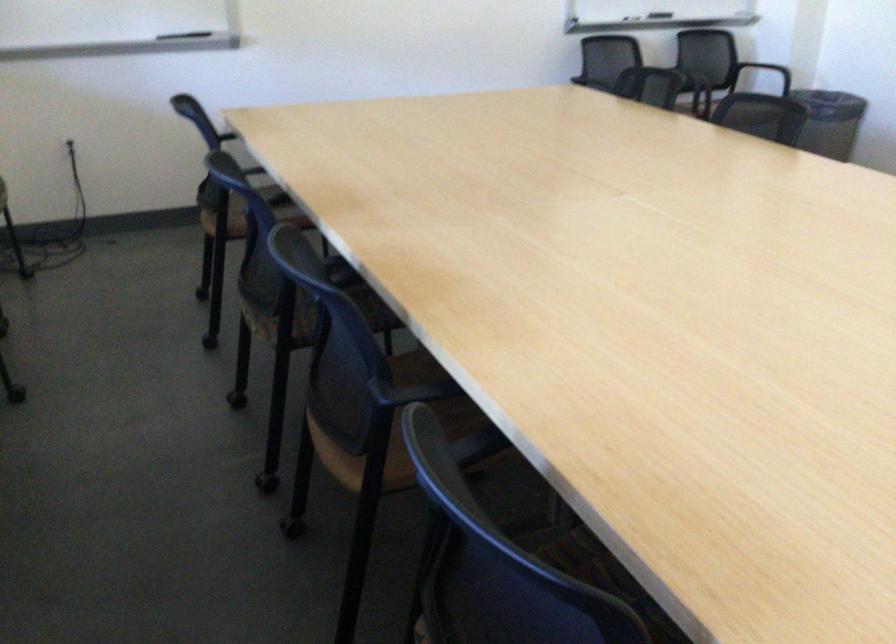
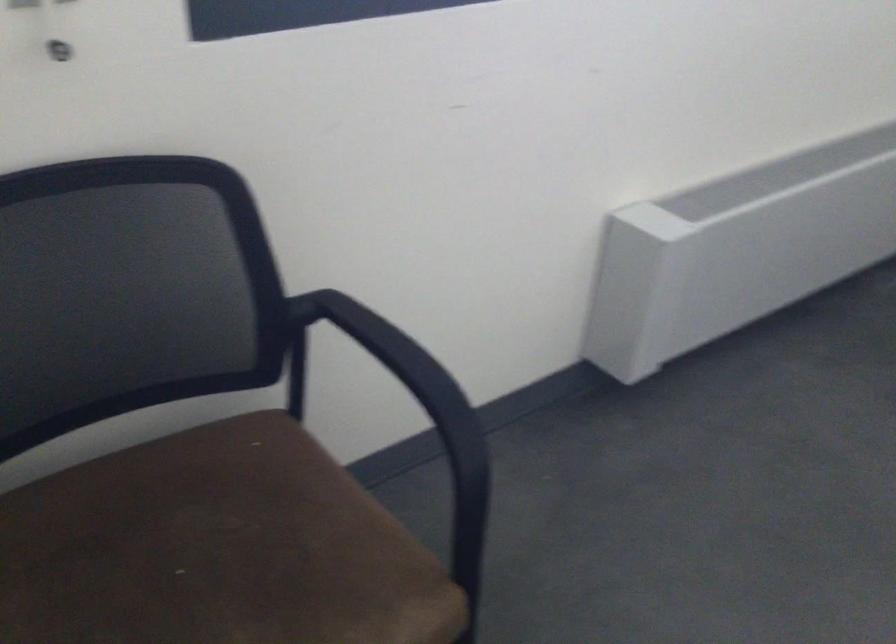
The first image is from the beginning of the video and the second image is from the end. How did the camera likely rotate when shooting the video?

The camera rotated toward left-down.